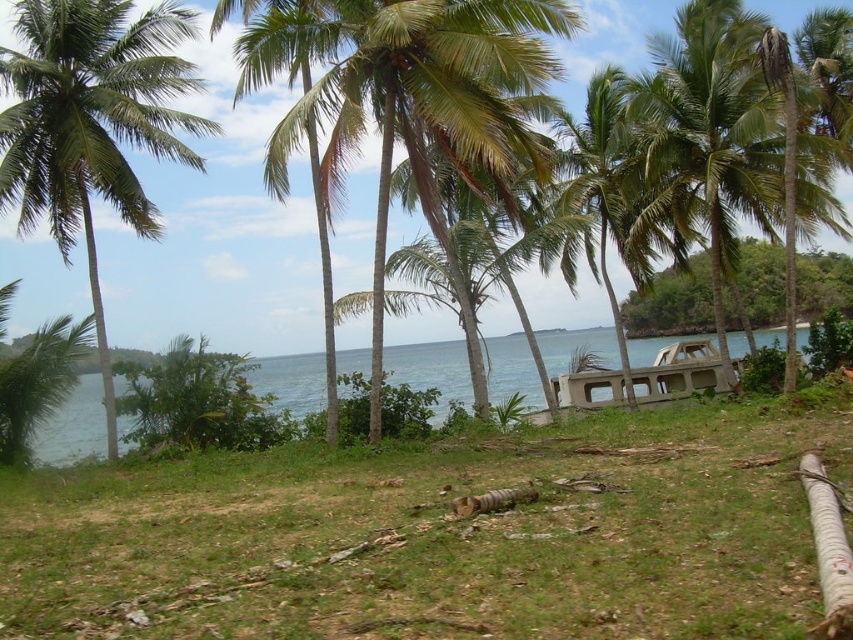
Question: Which point is farther to the camera?

Choices:
 (A) green leafy palm tree at left
 (B) green leafy coconut tree at center
 (C) green leafy palm tree at center

Answer: (A)

Question: Does green leafy palm tree at center appear under green leafy palm tree at right?

Choices:
 (A) no
 (B) yes

Answer: (B)

Question: Which point is closer to the camera taking this photo?

Choices:
 (A) tap(587, 273)
 (B) tap(508, 76)
 (C) tap(38, 460)

Answer: (B)

Question: Is green grass at center smaller than green leafy palm tree at left?

Choices:
 (A) yes
 (B) no

Answer: (B)

Question: Which point is farther to the camera?

Choices:
 (A) pos(558,364)
 (B) pos(277,620)
 (C) pos(7,177)

Answer: (A)

Question: Observing the image, what is the correct spatial positioning of green grass at center in reference to green leafy palm tree at right?

Choices:
 (A) below
 (B) above

Answer: (A)